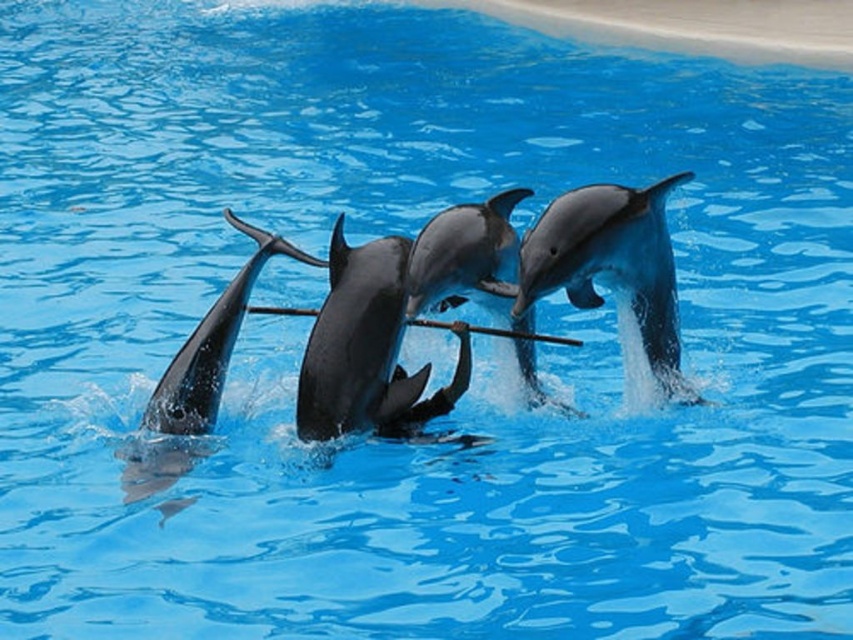
You are a marine biologist observing the dolphins in the pool. You notice two points in the water where the dolphins are interacting with the stick. Which of the two points, point (300, 426) or point (198, 444), is closer to you?

Point (300, 426) is closer to the viewer than point (198, 444).

You are a marine biologist observing the dolphins in the pool. You notice a specific point marked at coordinates (x=357, y=342). What is located at that point?

The point at coordinates (x=357, y=342) marks the location of the shiny black dolphin at center.

From the picture: You are a marine biologist observing the dolphins in the pool. You notice two dolphins holding a stick. Which dolphin is positioned closer to you, the shiny gray dolphin at center or the shiny black dolphin at center?

The shiny gray dolphin at center is closer to the viewer than the shiny black dolphin at center, so the shiny gray dolphin at center is positioned closer to you.